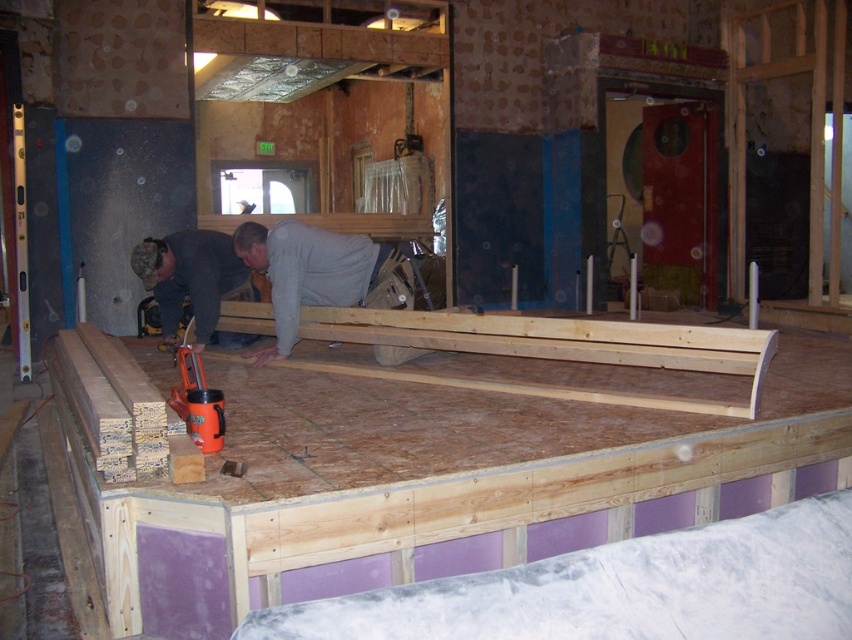
You are a safety inspector at the construction site depicted in the image. You need to ensure that all workers are wearing proper safety gear. Where is the gray matte shirt at center located in the image?

The gray matte shirt at center is located at point (304, 272) in the image.

You are a safety inspector observing the construction site. You notice the natural wood workbench at center and the gray matte shirt at center. Which object is wider in terms of physical dimensions?

The natural wood workbench at center is wider than the gray matte shirt at center, as its width surpasses the shirt.